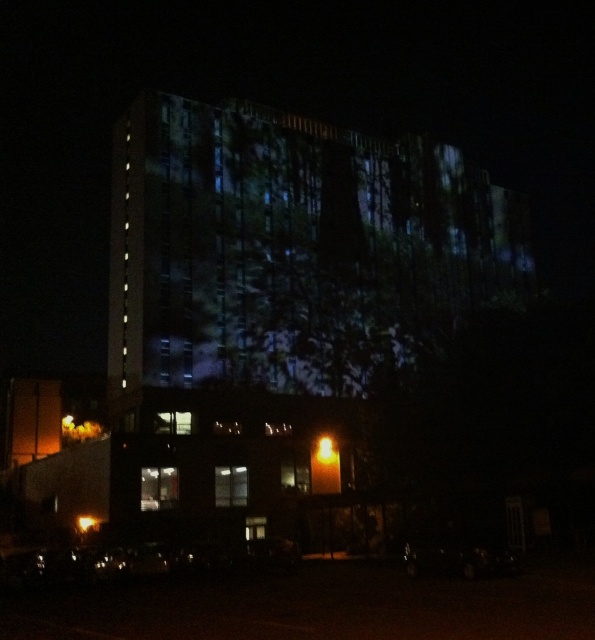
Question: In this image, where is bright orange light at center located relative to amber glass light at lower left?

Choices:
 (A) above
 (B) below

Answer: (A)

Question: Does bright orange light at center lie in front of amber glass light at lower left?

Choices:
 (A) yes
 (B) no

Answer: (B)

Question: Which of the following is the farthest from the observer?

Choices:
 (A) amber glass light at lower left
 (B) bright orange light at center

Answer: (B)

Question: From the image, what is the correct spatial relationship of bright orange light at center in relation to amber glass light at lower left?

Choices:
 (A) above
 (B) below

Answer: (A)

Question: Which point is farther to the camera?

Choices:
 (A) (82, 525)
 (B) (324, 451)

Answer: (B)